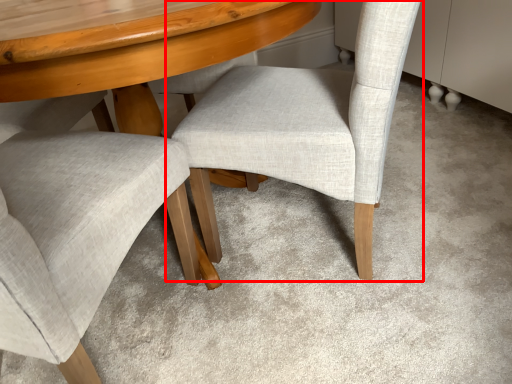
Question: From the image's perspective, considering the relative positions of chair (annotated by the red box) and chair in the image provided, where is chair (annotated by the red box) located with respect to the staircase?

Choices:
 (A) above
 (B) below

Answer: (A)